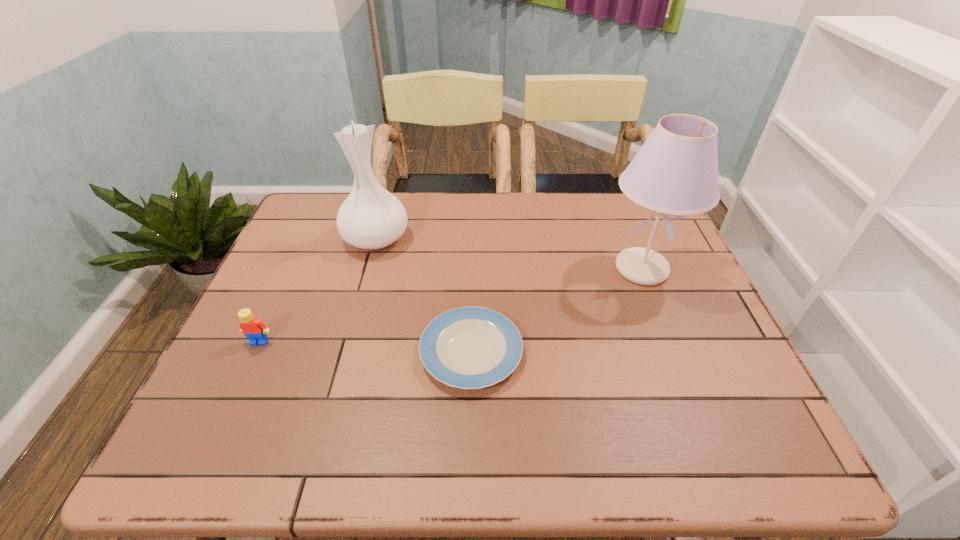
Where is `object that ranks as the third closest to the second object from left to right`? This screenshot has height=540, width=960. object that ranks as the third closest to the second object from left to right is located at coordinates (675, 172).

Locate an element on the screen. This screenshot has width=960, height=540. the second closest object relative to the shortest object is located at coordinates click(675, 172).

The image size is (960, 540). Find the location of `free location that satisfies the following two spatial constraints: 1. on the back side of the second object from right to left; 2. on the left side of the lampshade`. free location that satisfies the following two spatial constraints: 1. on the back side of the second object from right to left; 2. on the left side of the lampshade is located at coordinates (472, 269).